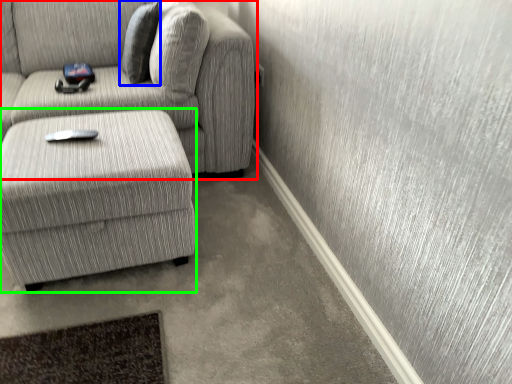
Question: Which is farther away from studio couch (highlighted by a red box)? pillow (highlighted by a blue box) or table (highlighted by a green box)?

Choices:
 (A) pillow
 (B) table

Answer: (B)